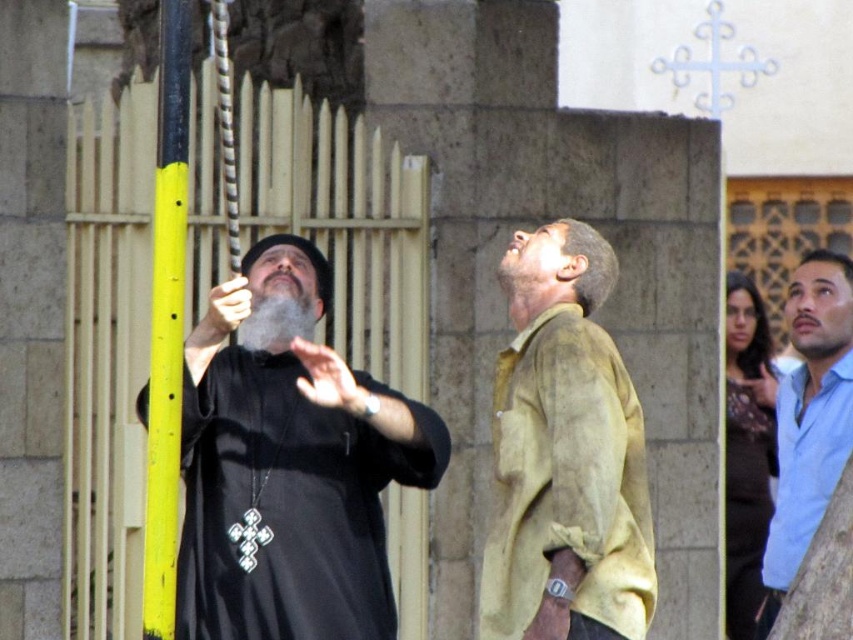
You are an observer standing in front of the scene. You see the light brown leather shirt at center and the yellow painted metal pole at left. Which object is closer to the ground?

The light brown leather shirt at center is positioned under the yellow painted metal pole at left, so the light brown leather shirt at center is closer to the ground.

Based on the scene description, if you were standing where the gray matte beard at center is located, would the black matte robe at left be visible above or below your current position?

The black matte robe at left is below the gray matte beard at center, so from the perspective of the gray matte beard at center, the black matte robe at left would be visible below their current position.